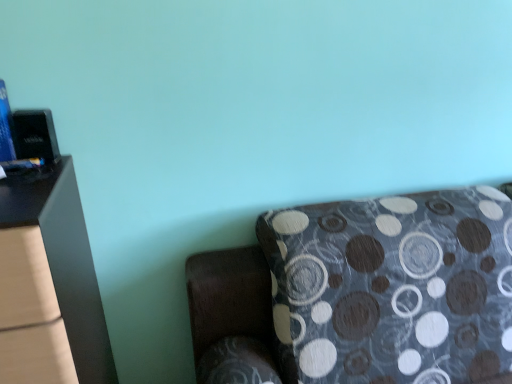
Question: Should I look upward or downward to see patterned fabric studio couch at lower right?

Choices:
 (A) up
 (B) down

Answer: (B)